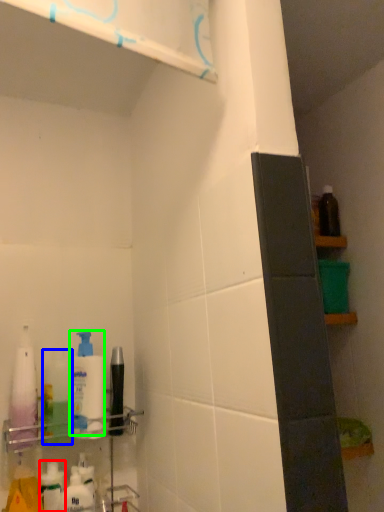
Question: Based on their relative distances, which object is nearer to toiletry (highlighted by a red box)? Choose from cleaning product (highlighted by a blue box) and cleaning product (highlighted by a green box).

Choices:
 (A) cleaning product
 (B) cleaning product

Answer: (A)